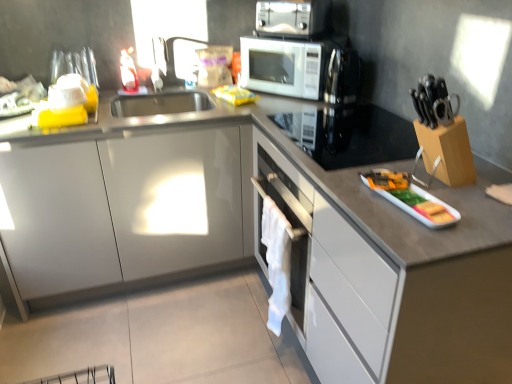
Question: From a real-world perspective, relative to black glass cooktop at upper right, placed as the 1th appliance when sorted from top to bottom, is white fabric at center vertically above or below?

Choices:
 (A) below
 (B) above

Answer: (A)

Question: Would you say white fabric at center is to the left or to the right of black glass cooktop at upper right, which ranks as the second appliance in front-to-back order, in the picture?

Choices:
 (A) right
 (B) left

Answer: (B)

Question: Which object is positioned closest to the white fabric at center?

Choices:
 (A) metallic silver toaster oven at upper center
 (B) yellow plastic bag at upper center
 (C) black glass cooktop at upper right, the first appliance from the back
 (D) white glossy tray at right, which appears as the 1th appliance when ordered from the bottom
 (E) white glossy drawer at right

Answer: (E)

Question: Which is nearer to the white glossy tray at right, the second appliance in the top-to-bottom sequence?

Choices:
 (A) white glossy microwave at upper center
 (B) yellow plastic bag at upper center
 (C) metallic silver toaster oven at upper center
 (D) white fabric at center
 (E) black glass cooktop at upper right, which is counted as the second appliance, starting from the bottom

Answer: (E)